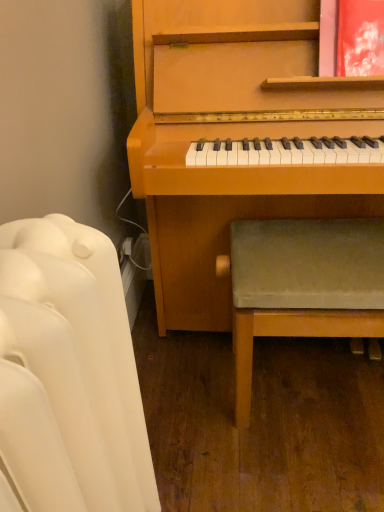
Describe the element at coordinates (302, 285) in the screenshot. I see `green fabric stool at lower right` at that location.

At what (x,y) coordinates should I click in order to perform the action: click on green fabric stool at lower right. Please return your answer as a coordinate pair (x, y). The image size is (384, 512). Looking at the image, I should click on (302, 285).

Measure the distance between green fabric stool at lower right and camera.

They are 36.43 inches apart.

Describe the element at coordinates (68, 375) in the screenshot. This screenshot has height=512, width=384. I see `white tufted sofa at left` at that location.

Where is `white tufted sofa at left`? The width and height of the screenshot is (384, 512). white tufted sofa at left is located at coordinates (68, 375).

Identify the location of green fabric stool at lower right. This screenshot has height=512, width=384. (302, 285).

Considering the relative positions of white tufted sofa at left and green fabric stool at lower right in the image provided, is white tufted sofa at left to the left of green fabric stool at lower right from the viewer's perspective?

Yes, white tufted sofa at left is to the left of green fabric stool at lower right.

Is the depth of white tufted sofa at left greater than that of green fabric stool at lower right?

No, the depth of white tufted sofa at left is less than that of green fabric stool at lower right.

Between point (2, 279) and point (264, 227), which one is positioned in front?

The point (2, 279) is closer to the camera.

From the image's perspective, does white tufted sofa at left appear higher than green fabric stool at lower right?

No, from the image's perspective, white tufted sofa at left is not above green fabric stool at lower right.

From a real-world perspective, who is located lower, white tufted sofa at left or green fabric stool at lower right?

green fabric stool at lower right.

Considering the sizes of white tufted sofa at left and green fabric stool at lower right in the image, is white tufted sofa at left wider or thinner than green fabric stool at lower right?

white tufted sofa at left is thinner than green fabric stool at lower right.

Between white tufted sofa at left and green fabric stool at lower right, which one has less height?

With less height is green fabric stool at lower right.

Does white tufted sofa at left have a smaller size compared to green fabric stool at lower right?

Correct, white tufted sofa at left occupies less space than green fabric stool at lower right.

Choose the correct answer: Is white tufted sofa at left inside green fabric stool at lower right or outside it?

white tufted sofa at left is not enclosed by green fabric stool at lower right.

Are white tufted sofa at left and green fabric stool at lower right far apart?

That's not correct — white tufted sofa at left is a little close to green fabric stool at lower right.

Is white tufted sofa at left facing away from green fabric stool at lower right?

That's not correct — white tufted sofa at left is not looking away from green fabric stool at lower right.

This screenshot has width=384, height=512. Find the location of `furniture located on the left of green fabric stool at lower right`. furniture located on the left of green fabric stool at lower right is located at coordinates (68, 375).

Between green fabric stool at lower right and white tufted sofa at left, which one appears on the right side from the viewer's perspective?

From the viewer's perspective, green fabric stool at lower right appears more on the right side.

Does green fabric stool at lower right lie in front of white tufted sofa at left?

No, green fabric stool at lower right is behind white tufted sofa at left.

Considering the points (257, 324) and (3, 323), which point is in front, point (257, 324) or point (3, 323)?

Point (3, 323)

From the image's perspective, would you say green fabric stool at lower right is shown under white tufted sofa at left?

No.

From a real-world perspective, is green fabric stool at lower right on white tufted sofa at left?

Incorrect, from a real-world perspective, green fabric stool at lower right is lower than white tufted sofa at left.

Is green fabric stool at lower right wider than white tufted sofa at left?

Yes.

In terms of height, does green fabric stool at lower right look taller or shorter compared to white tufted sofa at left?

green fabric stool at lower right is shorter than white tufted sofa at left.

Consider the image. Considering the sizes of objects green fabric stool at lower right and white tufted sofa at left in the image provided, who is bigger, green fabric stool at lower right or white tufted sofa at left?

With larger size is green fabric stool at lower right.

Choose the correct answer: Is green fabric stool at lower right inside white tufted sofa at left or outside it?

green fabric stool at lower right cannot be found inside white tufted sofa at left.

Is green fabric stool at lower right placed right next to white tufted sofa at left?

No, green fabric stool at lower right is not in contact with white tufted sofa at left.

Looking at this image, is green fabric stool at lower right oriented away from white tufted sofa at left?

No, green fabric stool at lower right is not facing away from white tufted sofa at left.

How different are the orientations of green fabric stool at lower right and white tufted sofa at left in degrees?

89.4 degrees separate the facing orientations of green fabric stool at lower right and white tufted sofa at left.

Find the location of a particular element. The image size is (384, 512). armchair that is above the white tufted sofa at left (from the image's perspective) is located at coordinates (302, 285).

I want to click on armchair above the white tufted sofa at left (from the image's perspective), so click(302, 285).

Locate an element on the screen. The image size is (384, 512). furniture lying below the green fabric stool at lower right (from the image's perspective) is located at coordinates (68, 375).